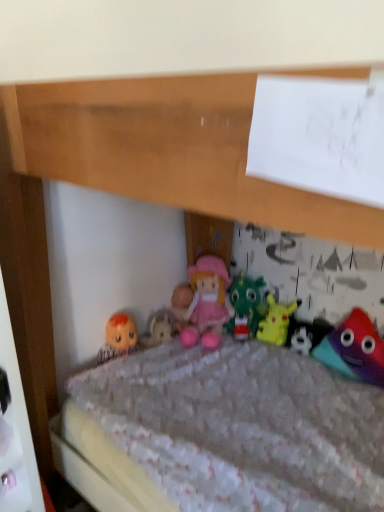
Question: Does multicolored plush toy at lower right, the first toy viewed from the right, turn towards pink fabric doll at center, placed as the fourth toy when sorted from right to left?

Choices:
 (A) no
 (B) yes

Answer: (A)

Question: Does multicolored plush toy at lower right, arranged as the fourth toy when viewed from the left, have a larger size compared to pink fabric doll at center, positioned as the 1th toy in left-to-right order?

Choices:
 (A) no
 (B) yes

Answer: (A)

Question: From the image's perspective, is multicolored plush toy at lower right, the first toy viewed from the right, below pink fabric doll at center, positioned as the 1th toy in left-to-right order?

Choices:
 (A) no
 (B) yes

Answer: (B)

Question: From a real-world perspective, is multicolored plush toy at lower right, the first toy viewed from the right, physically above pink fabric doll at center, placed as the fourth toy when sorted from right to left?

Choices:
 (A) no
 (B) yes

Answer: (A)

Question: Would you say pink fabric doll at center, positioned as the 1th toy in left-to-right order, is part of multicolored plush toy at lower right, the first toy viewed from the right,'s contents?

Choices:
 (A) yes
 (B) no

Answer: (B)

Question: From the image's perspective, does multicolored plush toy at lower right, arranged as the fourth toy when viewed from the left, appear higher than pink fabric doll at center, positioned as the 1th toy in left-to-right order?

Choices:
 (A) no
 (B) yes

Answer: (A)

Question: Does pink fabric doll at center come in front of pink fabric doll at center, positioned as the 1th toy in left-to-right order?

Choices:
 (A) yes
 (B) no

Answer: (A)

Question: Considering the relative sizes of pink fabric doll at center and pink fabric doll at center, placed as the fourth toy when sorted from right to left, in the image provided, is pink fabric doll at center wider than pink fabric doll at center, placed as the fourth toy when sorted from right to left,?

Choices:
 (A) yes
 (B) no

Answer: (A)

Question: Does pink fabric doll at center have a lesser width compared to pink fabric doll at center, positioned as the 1th toy in left-to-right order?

Choices:
 (A) yes
 (B) no

Answer: (B)

Question: Is pink fabric doll at center facing away from pink fabric doll at center, positioned as the 1th toy in left-to-right order?

Choices:
 (A) yes
 (B) no

Answer: (B)

Question: Could pink fabric doll at center, positioned as the 1th toy in left-to-right order, be considered to be inside pink fabric doll at center?

Choices:
 (A) no
 (B) yes

Answer: (A)

Question: Is pink fabric doll at center at the right side of pink fabric doll at center, positioned as the 1th toy in left-to-right order?

Choices:
 (A) no
 (B) yes

Answer: (A)

Question: Can you confirm if pink fabric doll at center is thinner than white plush toy at center, the 3th toy when ordered from left to right?

Choices:
 (A) no
 (B) yes

Answer: (A)